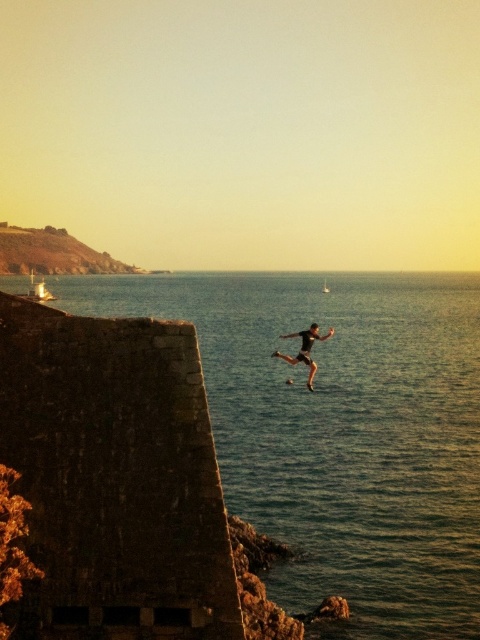
Question: Which of the following is the closest to the observer?

Choices:
 (A) dark skin/athletic wear person at center
 (B) blue water at center

Answer: (B)

Question: Does blue water at center appear on the left side of dark skin/athletic wear person at center?

Choices:
 (A) no
 (B) yes

Answer: (A)

Question: Does blue water at center have a smaller size compared to dark skin/athletic wear person at center?

Choices:
 (A) no
 (B) yes

Answer: (A)

Question: Which point is closer to the camera?

Choices:
 (A) blue water at center
 (B) dark skin/athletic wear person at center

Answer: (A)

Question: Does blue water at center have a lesser width compared to dark skin/athletic wear person at center?

Choices:
 (A) no
 (B) yes

Answer: (A)